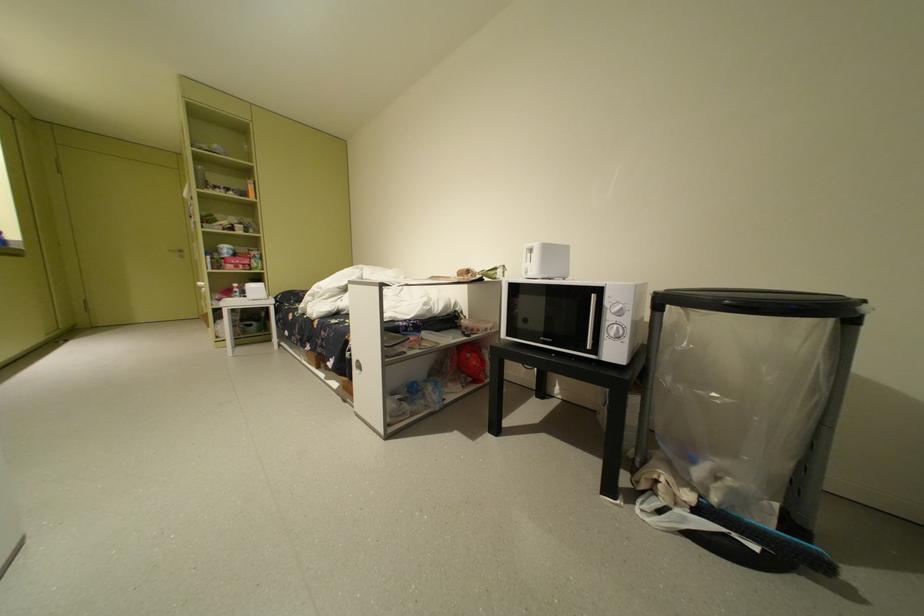
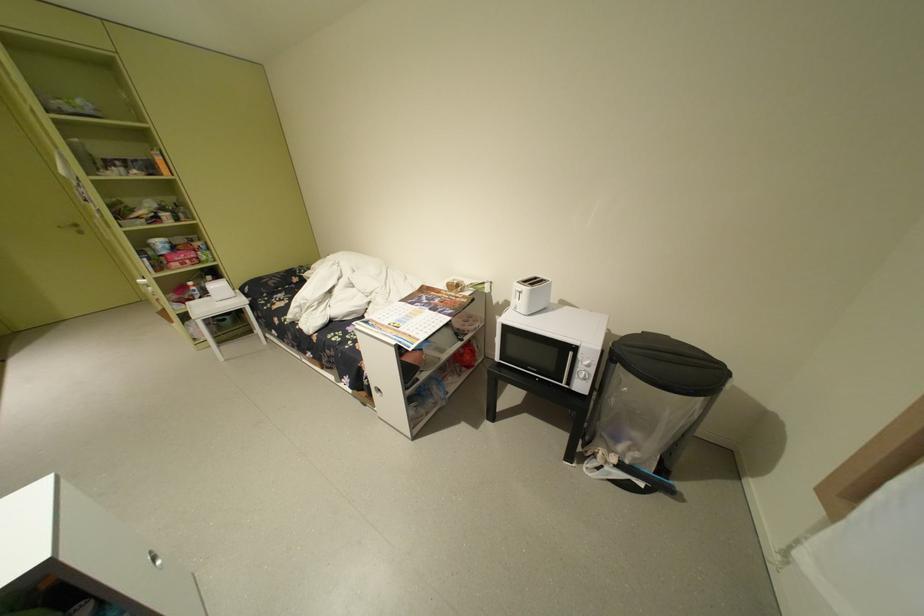
In the second image, find the point that corresponds to point 249,288 in the first image.

(204, 286)